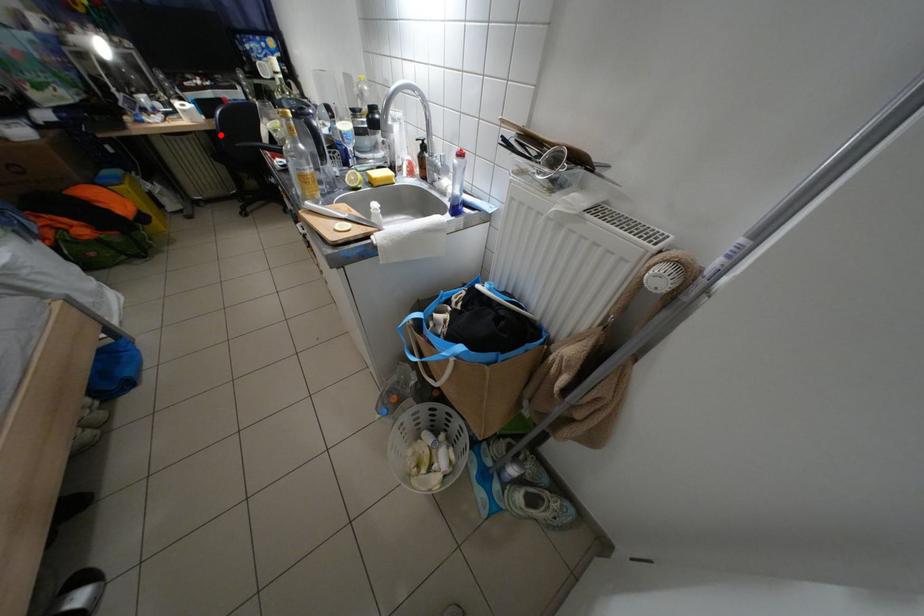
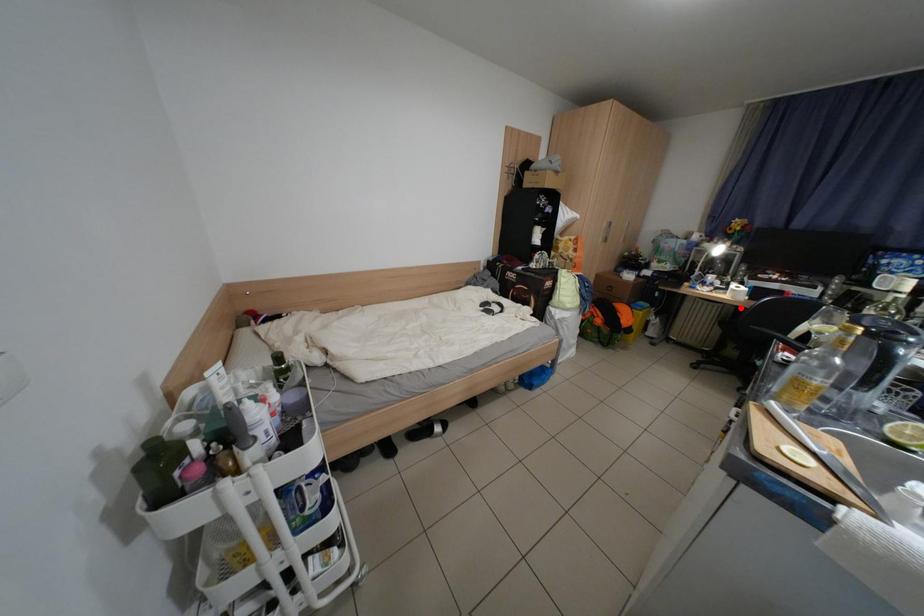
I am providing you with two images of the same scene from different viewpoints. A red point is marked on the first image and another point is marked on the second image. Are the points marked in image1 and image2 representing the same 3D position?

No